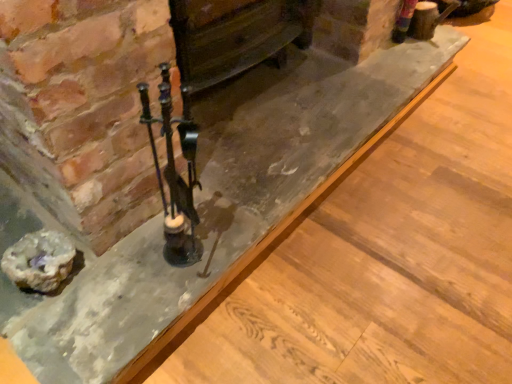
Describe the element at coordinates (39, 261) in the screenshot. I see `gray marble at lower left` at that location.

Find the location of a particular element. gray marble at lower left is located at coordinates (39, 261).

Where is `gray marble at lower left`? gray marble at lower left is located at coordinates (39, 261).